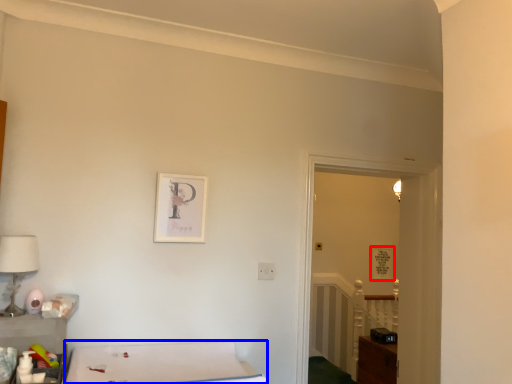
Question: Which object is further to the camera taking this photo, picture frame (highlighted by a red box) or furniture (highlighted by a blue box)?

Choices:
 (A) picture frame
 (B) furniture

Answer: (A)